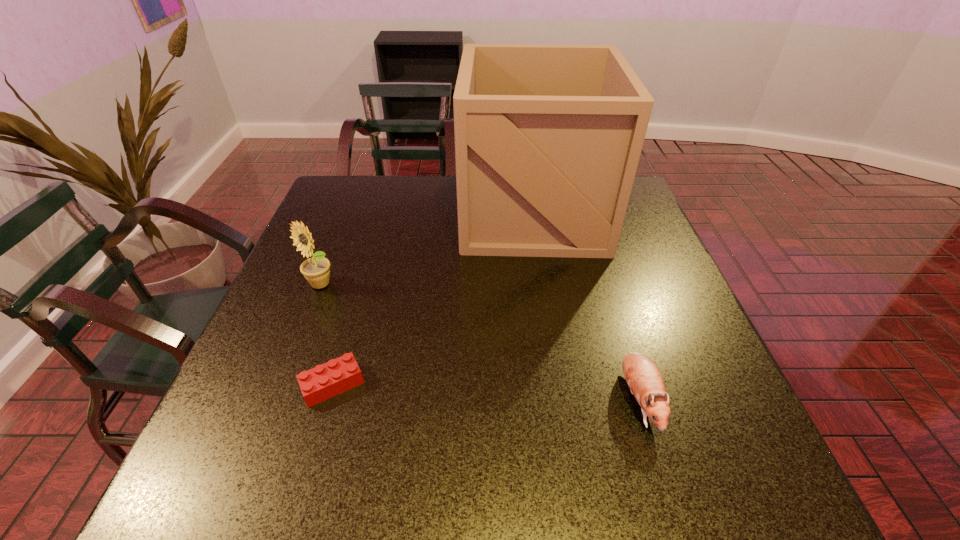
Where is `sunflower located in the left edge section of the desktop`? sunflower located in the left edge section of the desktop is located at coordinates (316, 270).

In order to click on Lego at the left edge in this screenshot , I will do `click(336, 376)`.

The height and width of the screenshot is (540, 960). I want to click on box that is at the right edge, so click(x=548, y=138).

Where is `hamster located at the right edge`? The height and width of the screenshot is (540, 960). hamster located at the right edge is located at coordinates (643, 377).

Where is `object that is at the far right corner`? The image size is (960, 540). object that is at the far right corner is located at coordinates (548, 138).

The height and width of the screenshot is (540, 960). Find the location of `blank space at the far edge of the desktop`. blank space at the far edge of the desktop is located at coordinates (454, 202).

The image size is (960, 540). What are the coordinates of `vacant area at the left edge of the desktop` in the screenshot? It's located at (267, 312).

The image size is (960, 540). What are the coordinates of `vacant space at the right edge of the desktop` in the screenshot? It's located at (667, 304).

Where is `free region at the far left corner of the desktop`? free region at the far left corner of the desktop is located at coordinates (369, 189).

The height and width of the screenshot is (540, 960). I want to click on vacant space at the near right corner of the desktop, so click(694, 474).